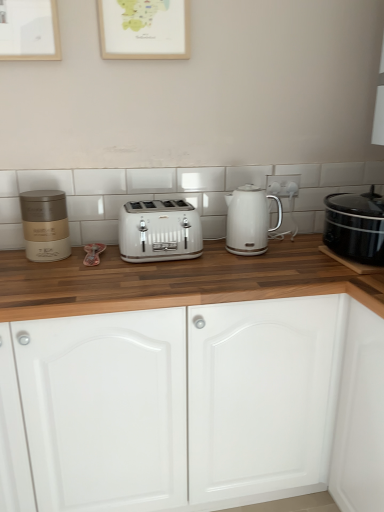
At what (x,y) coordinates should I click in order to perform the action: click on vacant area that is in front of matte gold container at left. Please return your answer as a coordinate pair (x, y). The height and width of the screenshot is (512, 384). Looking at the image, I should click on (39, 271).